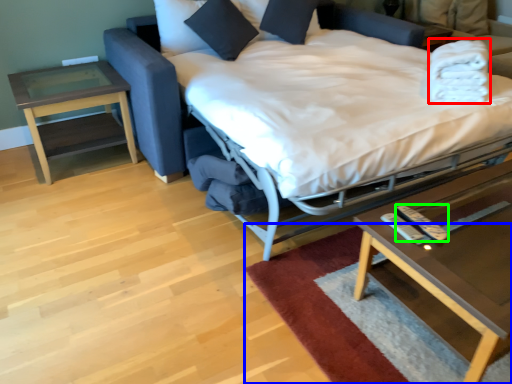
Question: Which object is positioned closest to blanket (highlighted by a red box)? Select from mat (highlighted by a blue box) and remote (highlighted by a green box).

Choices:
 (A) mat
 (B) remote

Answer: (B)